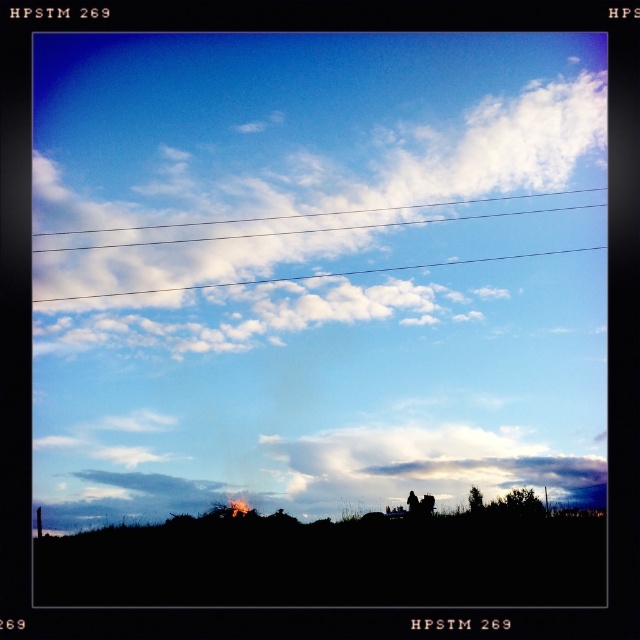
From the picture: Between white fluffy cloud at upper center and brushed metal telegraph pole at lower left, which one appears on the right side from the viewer's perspective?

white fluffy cloud at upper center is more to the right.

Between white fluffy cloud at upper center and brushed metal telegraph pole at lower left, which one has more height?

Standing taller between the two is white fluffy cloud at upper center.

You are a GUI agent. You are given a task and a screenshot of the screen. Output one action in this format:
    pyautogui.click(x=<x>, y=<y>)
    Task: Click on the white fluffy cloud at upper center
    
    Given the screenshot: What is the action you would take?
    (316, 212)

The image size is (640, 640). I want to click on white fluffy cloud at upper center, so click(316, 212).

Does point (404, 538) lie behind point (324, 212)?

No, it is in front of (324, 212).

Can you confirm if black matte hillside at lower center is smaller than white fluffy cloud at upper center?

Indeed, black matte hillside at lower center has a smaller size compared to white fluffy cloud at upper center.

Who is more forward, [387,589] or [275,218]?

Positioned in front is point [387,589].

Find the location of a particular element. This screenshot has width=640, height=640. black matte hillside at lower center is located at coordinates click(x=332, y=560).

Does black matte hillside at lower center have a lesser width compared to brushed metal telegraph pole at lower left?

No.

Is black matte hillside at lower center to the right of brushed metal telegraph pole at lower left from the viewer's perspective?

Yes, black matte hillside at lower center is to the right of brushed metal telegraph pole at lower left.

What do you see at coordinates (332, 560) in the screenshot? The image size is (640, 640). I see `black matte hillside at lower center` at bounding box center [332, 560].

At what (x,y) coordinates should I click in order to perform the action: click on black matte hillside at lower center. Please return your answer as a coordinate pair (x, y). Looking at the image, I should click on (332, 560).